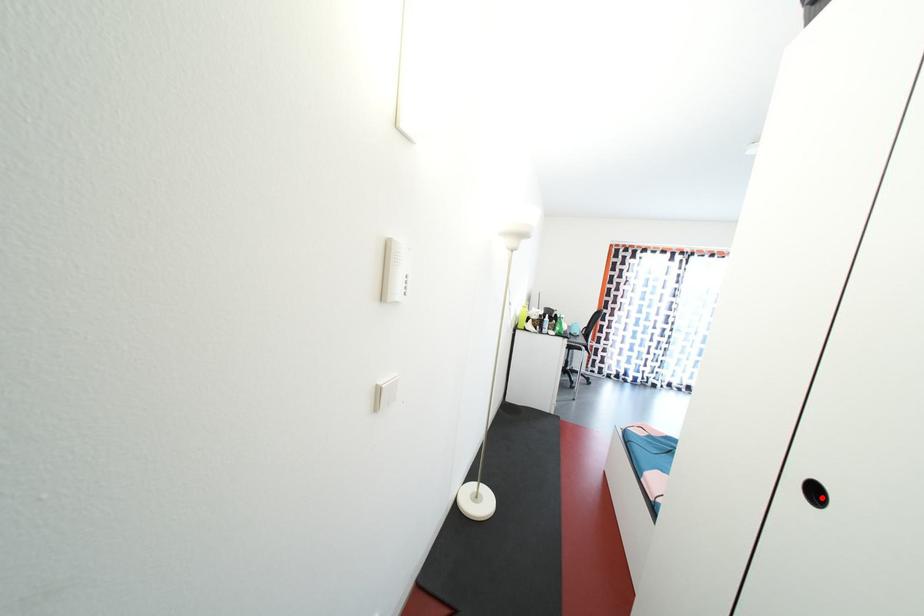
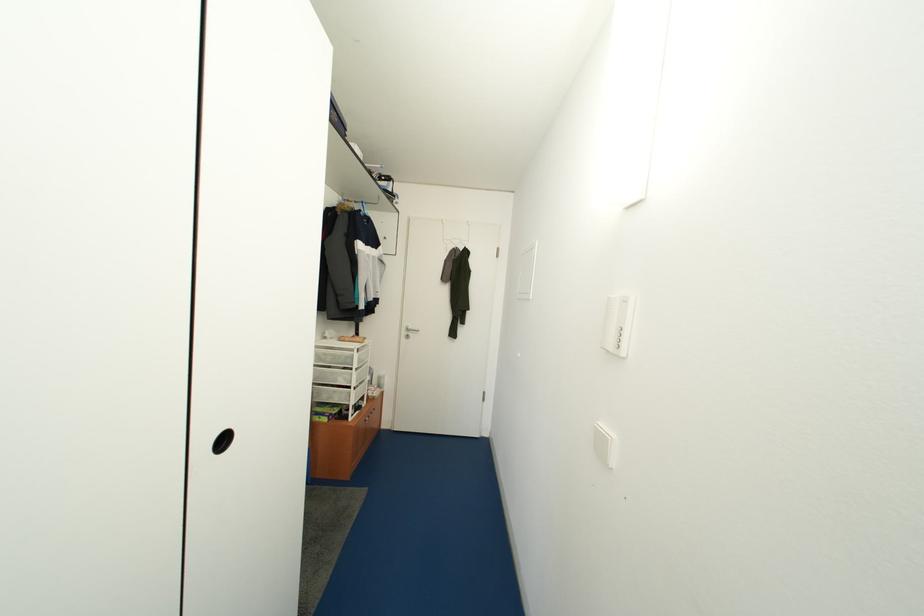
The point at the highlighted location is marked in the first image. Where is the corresponding point in the second image?

(232, 445)